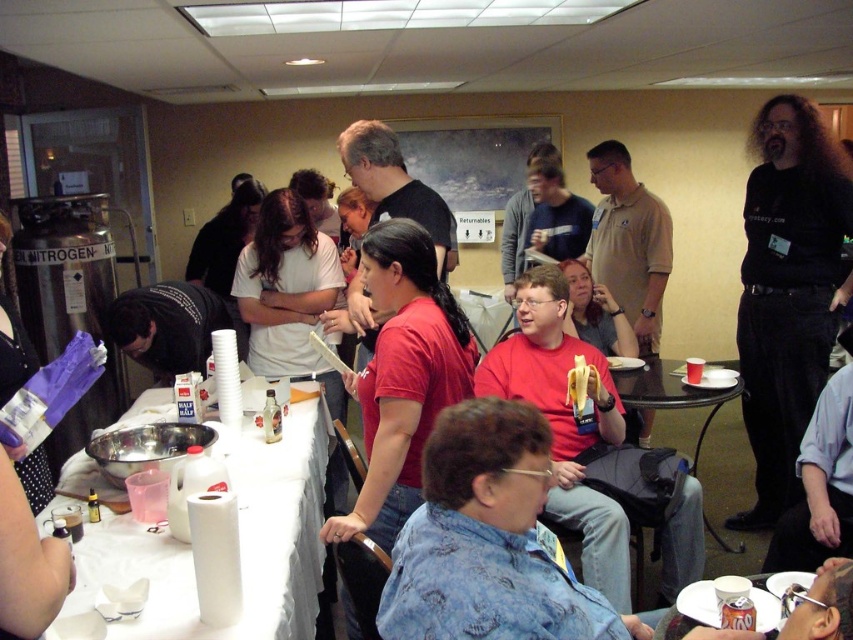
You are standing at the back of the room and want to grab the white paper towel at lower left. However, there is a person wearing the black matte shirt at left blocking your path. Can you reach the paper towel without moving the person?

The white paper towel at lower left is below the black matte shirt at left, so you can reach it without moving the person since it is positioned lower than the obstruction.